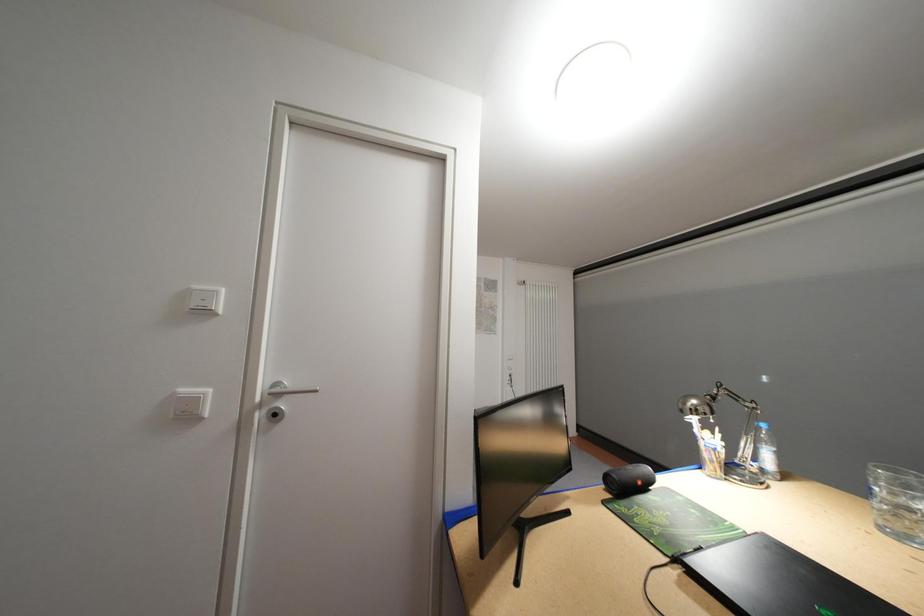
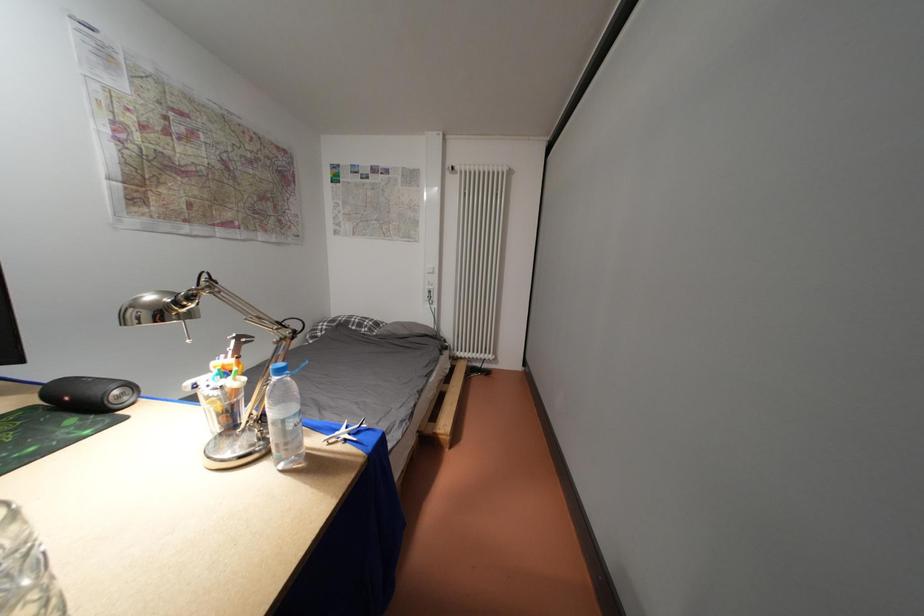
In a continuous first-person perspective shot, in which direction is the camera moving?

The cameraman moved toward right, forward.